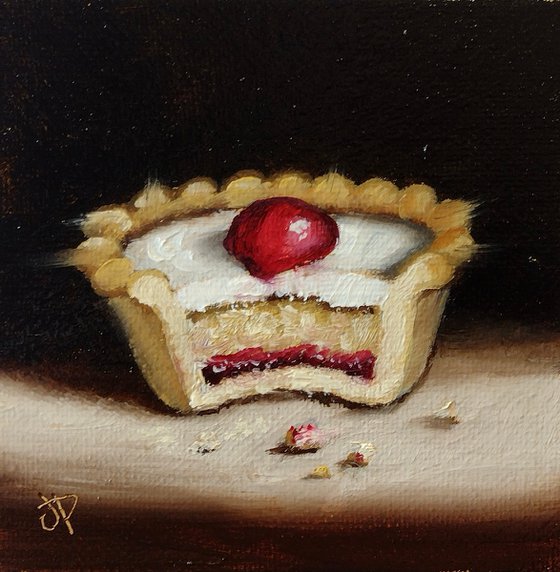
The image size is (560, 572). I want to click on painting, so click(274, 345).